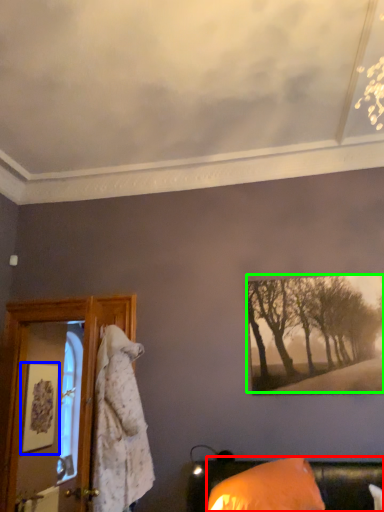
Question: Estimate the real-world distances between objects in this image. Which object is farther from furniture (highlighted by a red box), picture frame (highlighted by a blue box) or tree (highlighted by a green box)?

Choices:
 (A) picture frame
 (B) tree

Answer: (A)